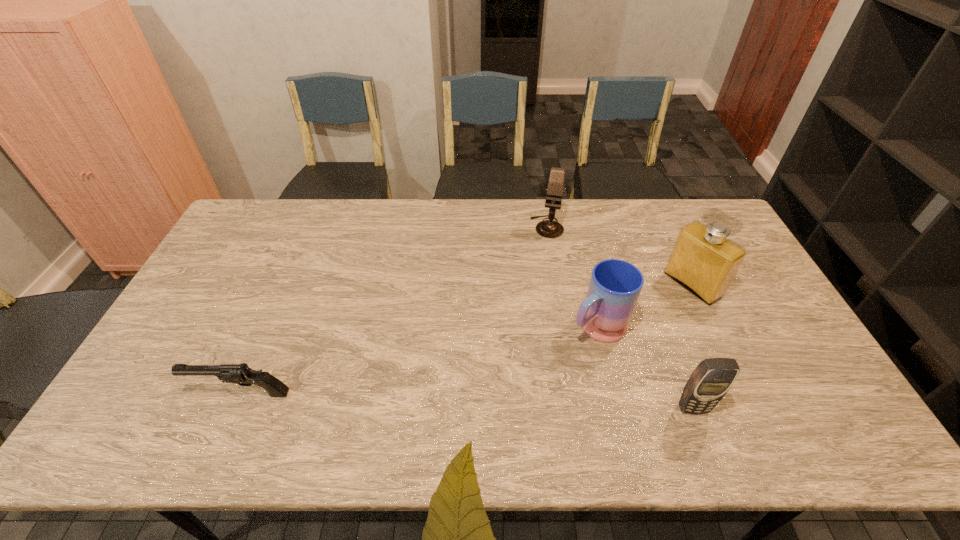
The height and width of the screenshot is (540, 960). I want to click on free space on the desktop that is between the fourth farthest object and the second object from right to left and is positioned on the side of the mug with the handle, so click(498, 402).

Find the location of a particular element. free space on the desktop that is between the second nearest object and the nearest object and is positioned on the front-facing side of the microphone is located at coordinates (514, 402).

The height and width of the screenshot is (540, 960). Find the location of `vacant space on the desktop that is between the gun and the second object from right to left and is positioned on the front-facing side of the rightmost object`. vacant space on the desktop that is between the gun and the second object from right to left and is positioned on the front-facing side of the rightmost object is located at coordinates (503, 402).